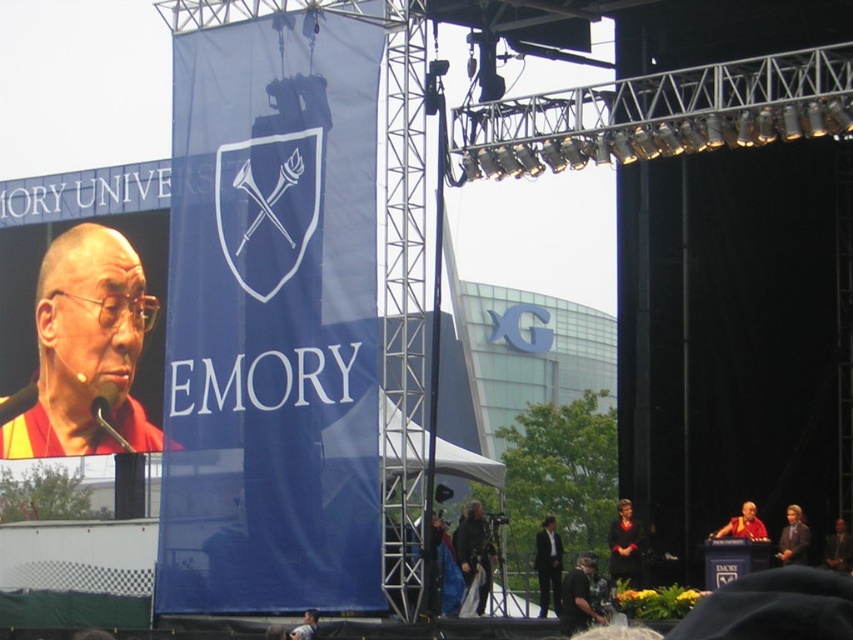
You are a photographer at the Emory University event and need to capture a photo of the red silk robe at center. What are the coordinates where you should focus your camera?

The red silk robe at center is located at coordinates point [743,525].

You are a photographer at the event and need to capture a photo that includes both the red silk robe at center and the dark brown leather jacket at center. Which object should you place on the left side of your frame to ensure both are in the shot?

To include both the red silk robe at center and the dark brown leather jacket at center in the photo, you should place the red silk robe at center on the left side of your frame since it is already positioned to the left of the dark brown leather jacket at center.

You are standing at the event venue and want to reach the stage where the speaker is presenting. The stage has a large blue banner with the Emory logo. There is a specific point marked at coordinates point (114,305). Can you estimate how far you need to walk to reach that point from your current position?

The distance between point (114,305) and the viewer is 368.31 feet, so you would need to walk approximately 368.31 feet to reach that point.